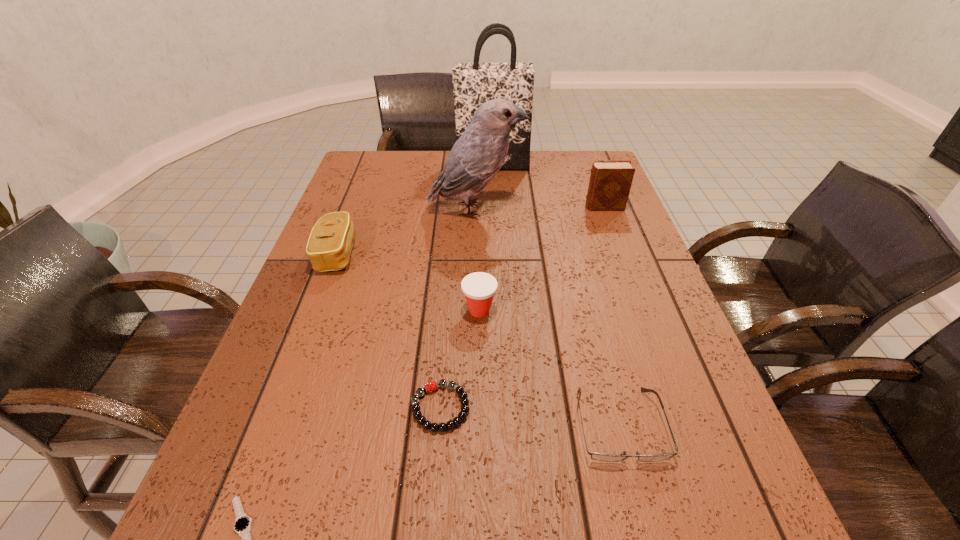
The height and width of the screenshot is (540, 960). Identify the location of spectacles at the right edge. (595, 456).

Locate an element on the screen. The image size is (960, 540). free region at the far edge of the desktop is located at coordinates (418, 182).

Image resolution: width=960 pixels, height=540 pixels. I want to click on free location at the near edge, so click(340, 521).

Where is `vacant region at the left edge of the desktop`? vacant region at the left edge of the desktop is located at coordinates (371, 249).

Locate an element on the screen. The width and height of the screenshot is (960, 540). free spot at the right edge of the desktop is located at coordinates (622, 259).

Where is `free space at the far left corner of the desktop`? This screenshot has height=540, width=960. free space at the far left corner of the desktop is located at coordinates pyautogui.click(x=350, y=179).

Find the location of a particular element. The width and height of the screenshot is (960, 540). vacant space at the near left corner of the desktop is located at coordinates (206, 522).

This screenshot has width=960, height=540. What are the coordinates of `vacant space at the near right corner of the desktop` in the screenshot? It's located at (687, 531).

At what (x,y) coordinates should I click in order to perform the action: click on free space between the third shortest object and the diary. Please return your answer as a coordinate pair (x, y). The height and width of the screenshot is (540, 960). Looking at the image, I should click on (612, 316).

Where is `vacant space that's between the sixth shortest object and the fifth nearest object`? vacant space that's between the sixth shortest object and the fifth nearest object is located at coordinates (470, 230).